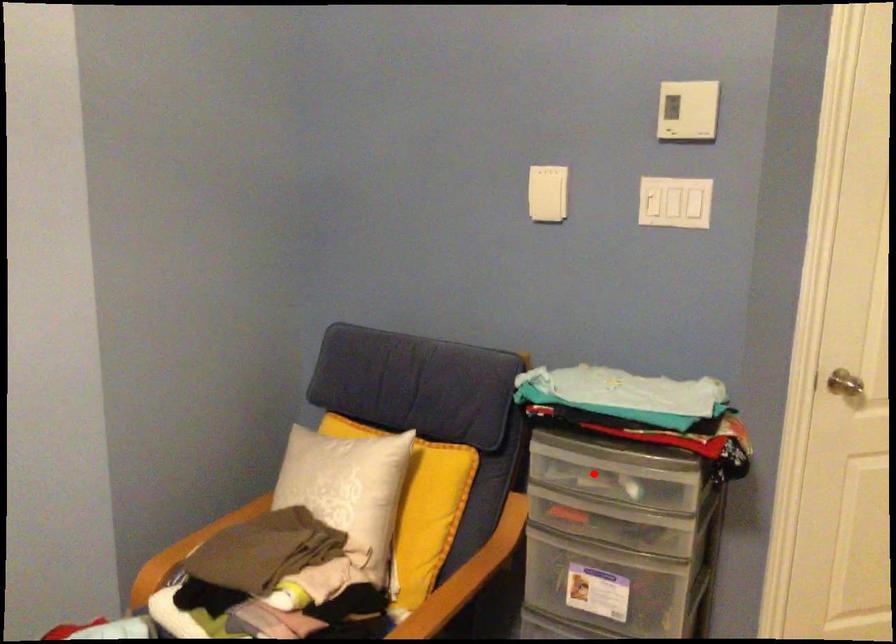
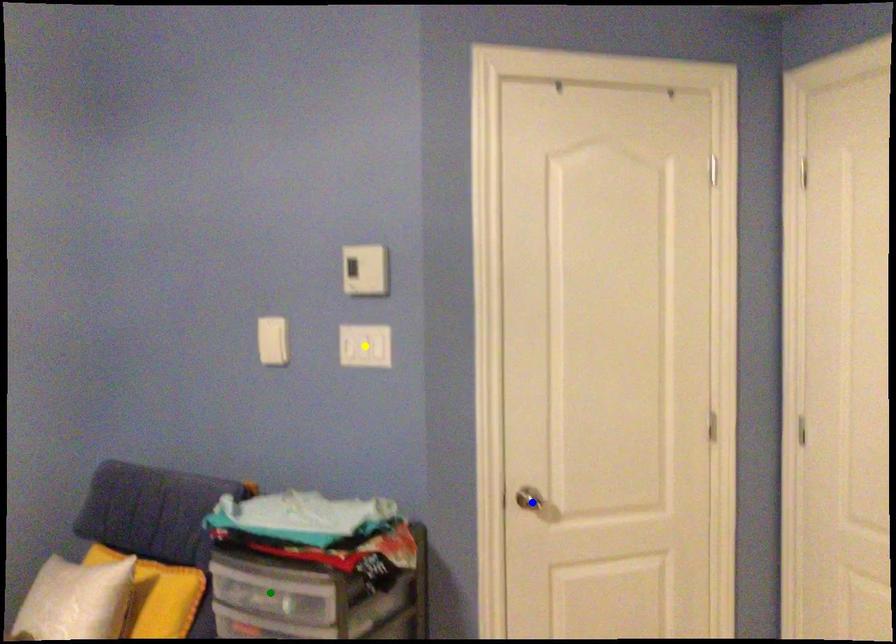
Question: I am providing you with two images of the same scene from different viewpoints. A red point is marked on the first image. You are given multiple points on the second image. In image 2, which mark is for the same physical point as the one in image 1?

Choices:
 (A) yellow point
 (B) blue point
 (C) green point

Answer: (C)